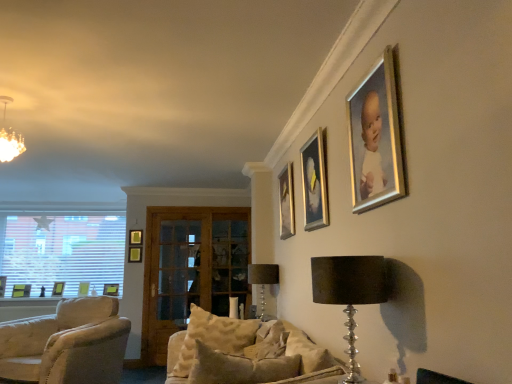
Question: From a real-world perspective, is textured beige pillow at center located beneath clear glass door at center, the 1th glass door positioned from the right?

Choices:
 (A) no
 (B) yes

Answer: (B)

Question: Considering the relative sizes of textured beige pillow at center and clear glass door at center, which appears as the second glass door when viewed from the left, in the image provided, is textured beige pillow at center wider than clear glass door at center, which appears as the second glass door when viewed from the left,?

Choices:
 (A) yes
 (B) no

Answer: (A)

Question: Would you say textured beige pillow at center is a long distance from clear glass door at center, which appears as the second glass door when viewed from the left?

Choices:
 (A) yes
 (B) no

Answer: (A)

Question: Is textured beige pillow at center surrounding clear glass door at center, the 1th glass door positioned from the right?

Choices:
 (A) yes
 (B) no

Answer: (B)

Question: Is textured beige pillow at center facing towards clear glass door at center, the 1th glass door positioned from the right?

Choices:
 (A) no
 (B) yes

Answer: (A)

Question: From a real-world perspective, is textured beige pillow at center physically above clear glass door at center, the 1th glass door positioned from the right?

Choices:
 (A) yes
 (B) no

Answer: (B)

Question: From a real-world perspective, is clear glass door at center, which appears as the second glass door when viewed from the left, beneath clear glass door at center, which is the first glass door from left to right?

Choices:
 (A) no
 (B) yes

Answer: (A)

Question: Does clear glass door at center, the 1th glass door positioned from the right, have a larger size compared to clear glass door at center, which is the first glass door from left to right?

Choices:
 (A) yes
 (B) no

Answer: (B)

Question: Could you tell me if clear glass door at center, the 1th glass door positioned from the right, is facing clear glass door at center, placed as the 2th glass door when sorted from right to left?

Choices:
 (A) no
 (B) yes

Answer: (B)

Question: Is clear glass door at center, the 1th glass door positioned from the right, positioned far away from clear glass door at center, placed as the 2th glass door when sorted from right to left?

Choices:
 (A) yes
 (B) no

Answer: (B)

Question: Is clear glass door at center, the 1th glass door positioned from the right, positioned beyond the bounds of clear glass door at center, placed as the 2th glass door when sorted from right to left?

Choices:
 (A) yes
 (B) no

Answer: (B)

Question: Is clear glass door at center, which appears as the second glass door when viewed from the left, surrounding clear glass door at center, placed as the 2th glass door when sorted from right to left?

Choices:
 (A) no
 (B) yes

Answer: (B)

Question: Does white blinds at left have a lesser height compared to matte green picture frame at lower left, the sixth picture frame from the right?

Choices:
 (A) yes
 (B) no

Answer: (B)